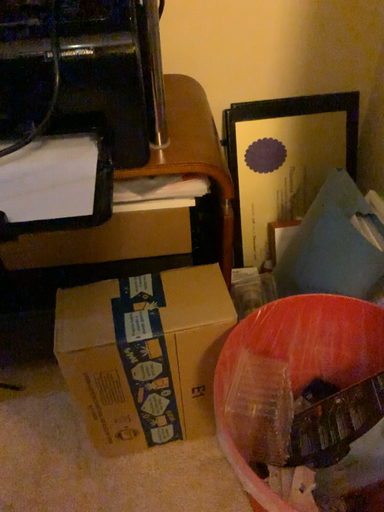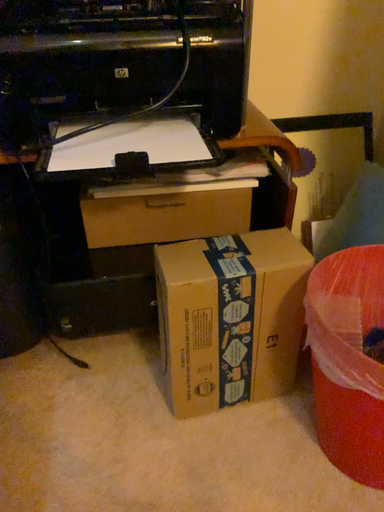
Question: Which way did the camera rotate in the video?

Choices:
 (A) rotated upward
 (B) rotated downward

Answer: (A)